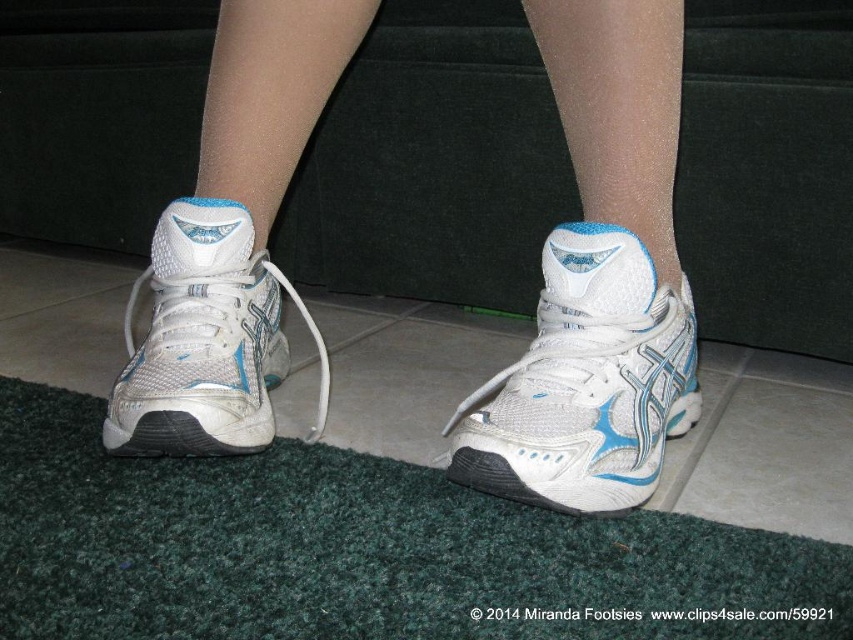
You are a virtual assistant analyzing the image. The scene shows a person wearing white athletic shoes with blue accents. There is a point marked at coordinates (x=599, y=280). Based on the image description, can you determine which object this point is located on?

The point at coordinates (x=599, y=280) is located on the white mesh sneakers at center.

You are trying to decide which pair of shoes to take for a run. You have the white mesh sneakers at center and the white mesh shoe at lower left. Based on their appearance in the image, which one might be more comfortable for your feet?

The white mesh sneakers at center might be more comfortable because they are wider than the white mesh shoe at lower left.

You are standing on the green carpet and see two points marked on the floor. The first point is at coordinate point (552, 307) and the second is at point (206, 449). If you want to walk towards the point that is closer to you, which coordinate should you head towards?

Point (206, 449) is closer to you because it is in front of point (552, 307), so you should head towards point (206, 449).